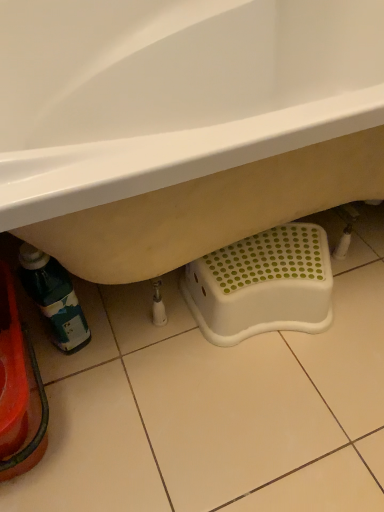
What do you see at coordinates (182, 124) in the screenshot? The height and width of the screenshot is (512, 384). I see `white glossy bathtub at center` at bounding box center [182, 124].

This screenshot has width=384, height=512. Identify the location of white glossy bathtub at center. (182, 124).

Locate an element on the screen. This screenshot has height=512, width=384. white glossy bathtub at center is located at coordinates (182, 124).